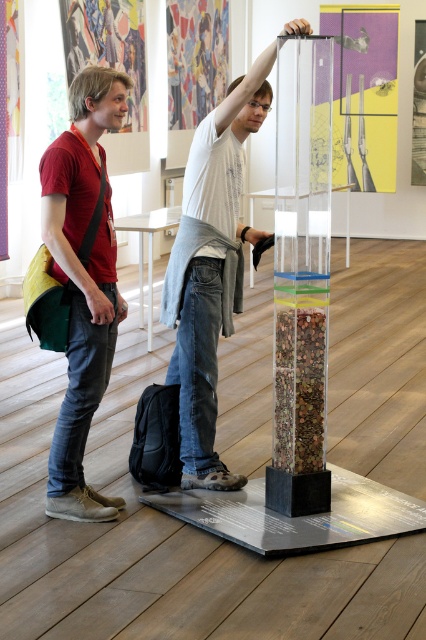
Does point (322, 264) lie behind point (204, 385)?

That is False.

Which is in front, point (328, 220) or point (212, 259)?

Point (328, 220)

Who is more forward, (313, 326) or (192, 484)?

Positioned in front is point (313, 326).

Identify the location of transparent acrylic tube at center. (301, 276).

Can you confirm if transparent acrylic tube at center is taller than matte red shirt at left?

Yes, transparent acrylic tube at center is taller than matte red shirt at left.

Is transparent acrylic tube at center above matte red shirt at left?

→ Indeed, transparent acrylic tube at center is positioned over matte red shirt at left.

This screenshot has width=426, height=640. In order to click on transparent acrylic tube at center in this screenshot , I will do `click(301, 276)`.

Who is lower down, white matte shirt at center or matte red shirt at left?

matte red shirt at left is lower down.

Does white matte shirt at center lie in front of matte red shirt at left?

Yes, white matte shirt at center is closer to the viewer.

Is point (233, 202) less distant than point (66, 218)?

No.

You are a GUI agent. You are given a task and a screenshot of the screen. Output one action in this format:
    pyautogui.click(x=<x>, y=<y>)
    Task: Click on the white matte shirt at center
    The image size is (426, 640).
    Given the screenshot: What is the action you would take?
    pyautogui.click(x=210, y=268)